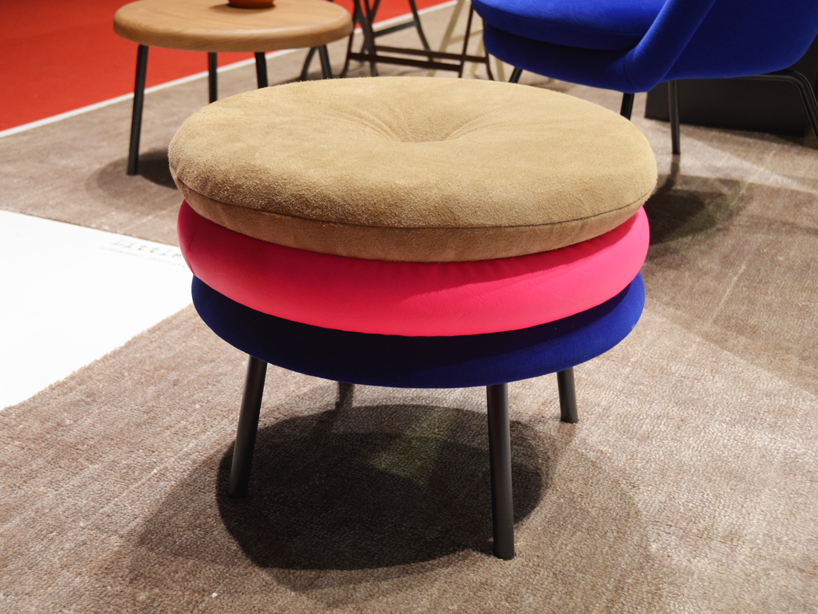
Locate an element on the screen. This screenshot has width=818, height=614. stool leg is located at coordinates (209, 79).